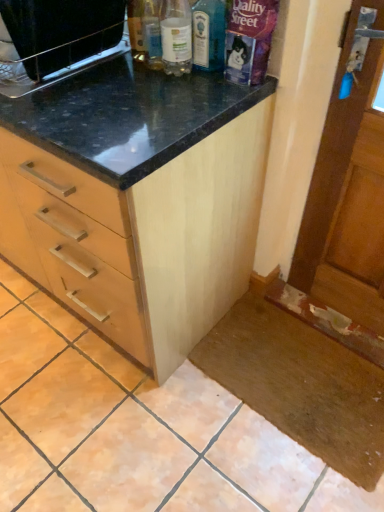
This screenshot has height=512, width=384. What are the coordinates of `free space in front of black matte microwave at upper left` in the screenshot? It's located at (79, 103).